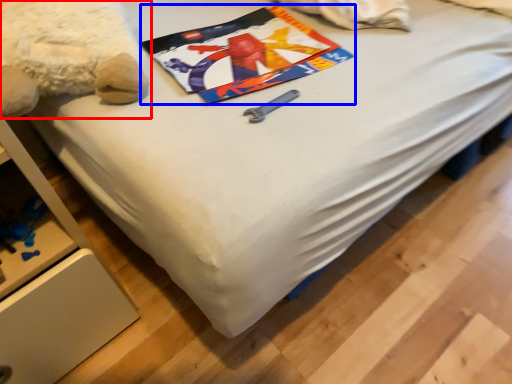
Question: Which of the following is the farthest to the observer, teddy bear (highlighted by a red box) or design (highlighted by a blue box)?

Choices:
 (A) teddy bear
 (B) design

Answer: (B)